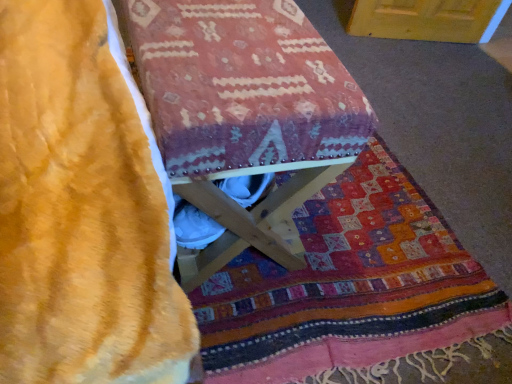
Where is `free spot above velvety yellow blanket at lower left (from a real-world perspective)`? free spot above velvety yellow blanket at lower left (from a real-world perspective) is located at coordinates (342, 281).